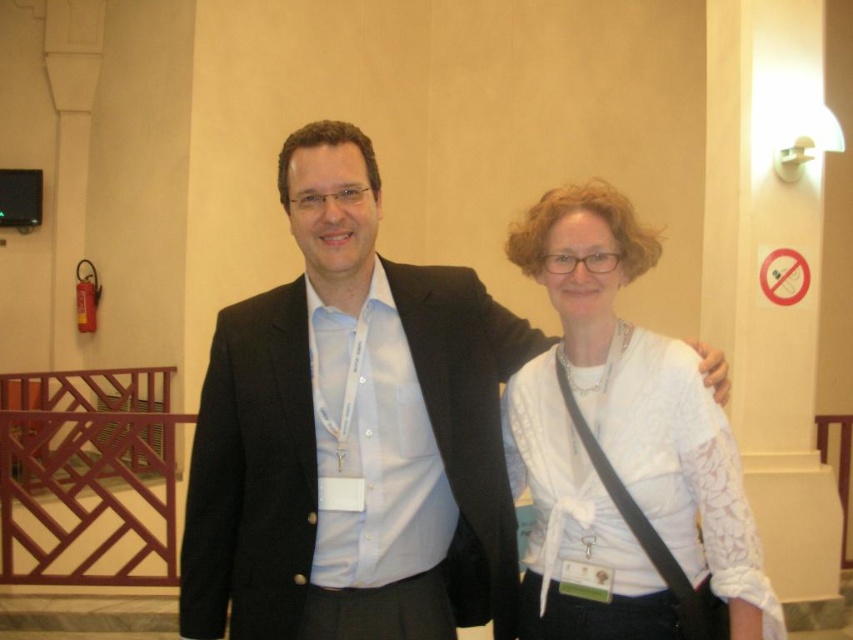
You are at the event and want to take a photo of both the person on the left and the person on the right. You notice two points marked in the scene, one at coordinates point (300, 180) and another at point (740, 524). Which point is closer to you, the photographer?

Point (300, 180) is closer to you than point (740, 524) because it is further to the camera.

You are at a conference and need to identify two key presenters based on their attire. The black matte suit at center and the white lace shirt at center are both in the central area. Which one is positioned to the left of the other?

The black matte suit at center is to the left of the white lace shirt at center.

From the picture: You are at a conference and need to decide which item to place on a shelf that can only hold items up to 1.2 meters in height. Given the black matte suit at center and the white lace shirt at center, which one can fit on the shelf?

The black matte suit at center is taller than the white lace shirt at center. Since the shelf can only hold items up to 1.2 meters, the white lace shirt at center is the one that can fit on the shelf.